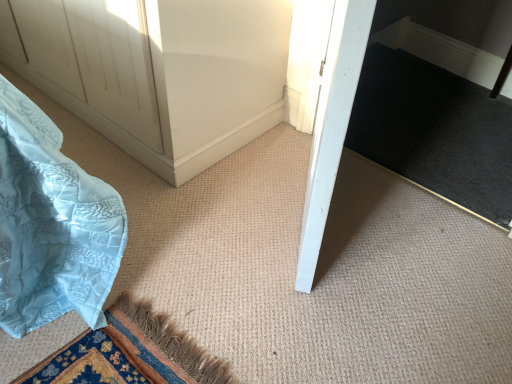
You are a GUI agent. You are given a task and a screenshot of the screen. Output one action in this format:
    pyautogui.click(x=<x>, y=<y>)
    Task: Click on the free spot above black carpet at center (from a real-world perspective)
    
    Given the screenshot: What is the action you would take?
    pyautogui.click(x=413, y=90)